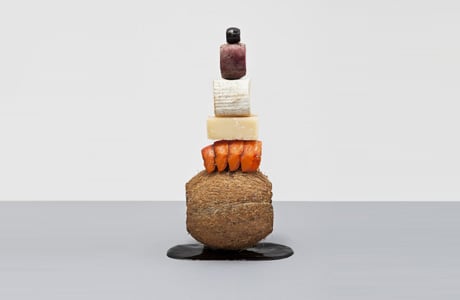
You are a GUI agent. You are given a task and a screenshot of the screen. Output one action in this format:
    pyautogui.click(x=<x>, y=<y>)
    Task: Click on the white wall
    
    Given the screenshot: What is the action you would take?
    pyautogui.click(x=347, y=141)